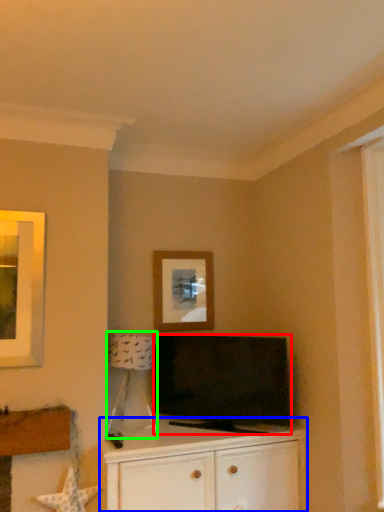
Question: Considering the real-world distances, which object is closest to television (highlighted by a red box)? cabinetry (highlighted by a blue box) or lamp (highlighted by a green box).

Choices:
 (A) cabinetry
 (B) lamp

Answer: (A)